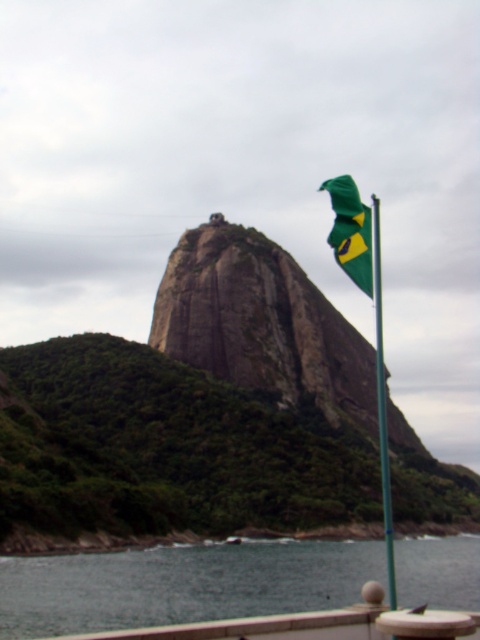
Question: Which object is the farthest from the green rock at center?

Choices:
 (A) green fabric flag at right
 (B) green fabric flag at upper right

Answer: (B)

Question: Is green rock at center thinner than green fabric flag at right?

Choices:
 (A) yes
 (B) no

Answer: (B)

Question: Does green rock at center appear on the right side of smooth water at lower center?

Choices:
 (A) yes
 (B) no

Answer: (B)

Question: Does smooth water at lower center appear on the right side of green fabric flag at right?

Choices:
 (A) yes
 (B) no

Answer: (B)

Question: Which object is the farthest from the green rock at center?

Choices:
 (A) smooth water at lower center
 (B) green fabric flag at upper right

Answer: (B)

Question: Which object appears farthest from the camera in this image?

Choices:
 (A) green fabric flag at right
 (B) smooth water at lower center

Answer: (B)